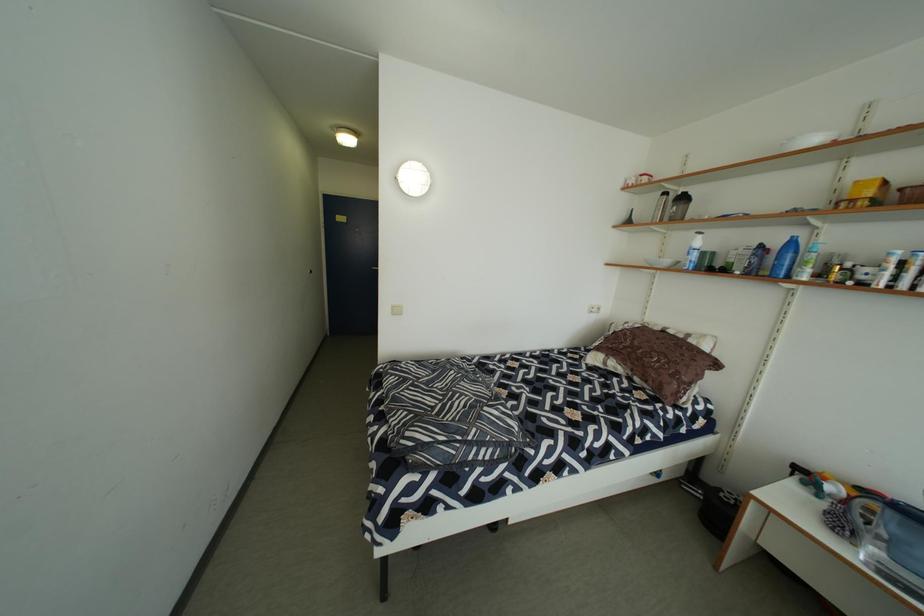
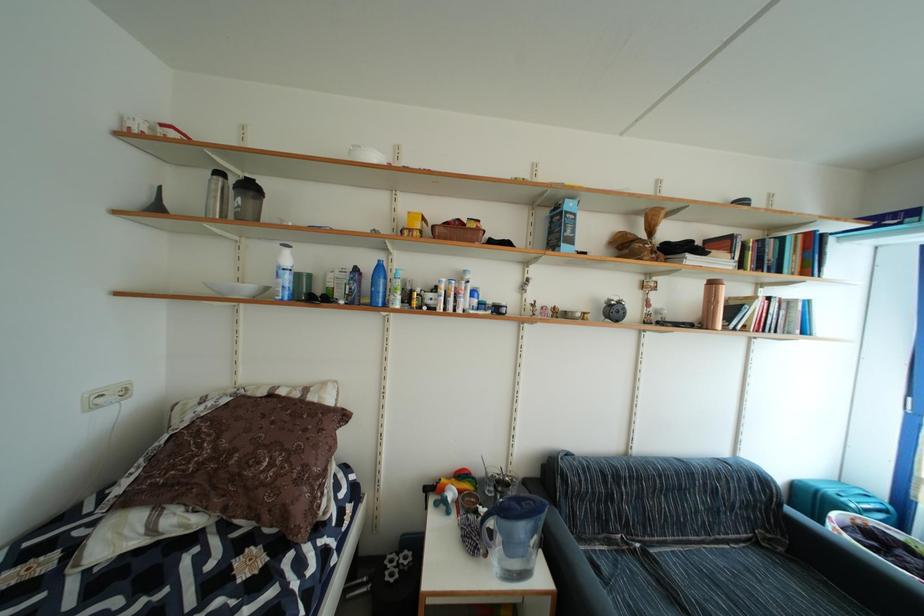
Question: The camera is either moving clockwise (left) or counter-clockwise (right) around the object. The first image is from the beginning of the video and the second image is from the end. Is the camera moving left or right when shooting the video?

Choices:
 (A) Left
 (B) Right

Answer: (A)